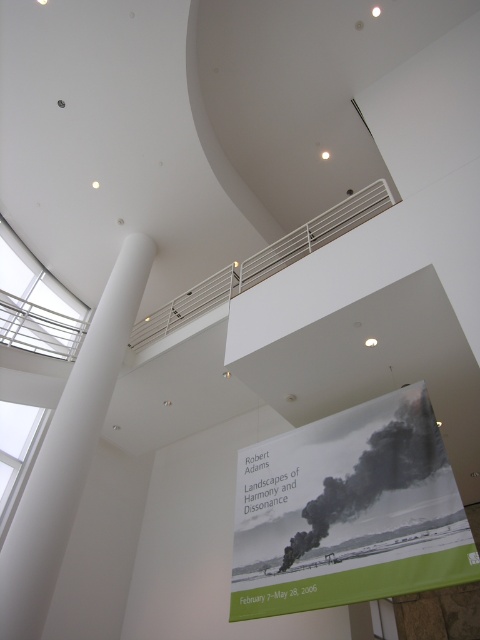
Question: Is white smooth column at center below white metal rail at upper center?

Choices:
 (A) yes
 (B) no

Answer: (A)

Question: Can you confirm if white smooth column at center is wider than white metal rail at upper center?

Choices:
 (A) no
 (B) yes

Answer: (A)

Question: Which object appears farthest from the camera in this image?

Choices:
 (A) green matte poster at lower center
 (B) white smooth column at center

Answer: (B)

Question: Which point is closer to the camera taking this photo?

Choices:
 (A) (113, 300)
 (B) (442, 518)

Answer: (B)

Question: Which point is farther from the camera taking this photo?

Choices:
 (A) (177, 324)
 (B) (448, 509)

Answer: (A)

Question: Is green matte poster at lower center positioned in front of white smooth column at center?

Choices:
 (A) yes
 (B) no

Answer: (A)